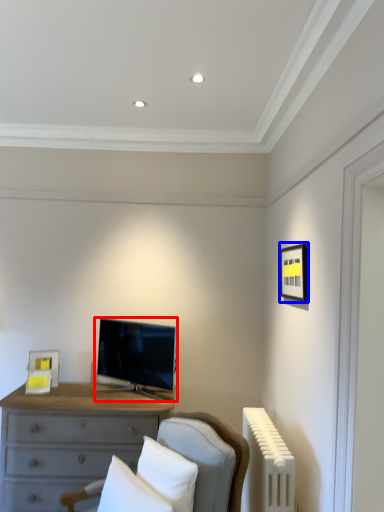
Question: Which of the following is the farthest to the observer, television (highlighted by a red box) or picture frame (highlighted by a blue box)?

Choices:
 (A) television
 (B) picture frame

Answer: (A)